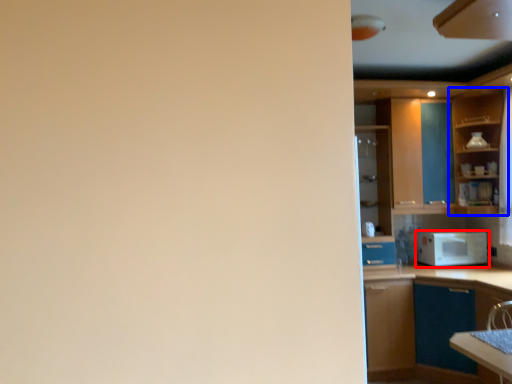
Question: Which object appears closest to the camera in this image, microwave oven (highlighted by a red box) or cabinetry (highlighted by a blue box)?

Choices:
 (A) microwave oven
 (B) cabinetry

Answer: (B)